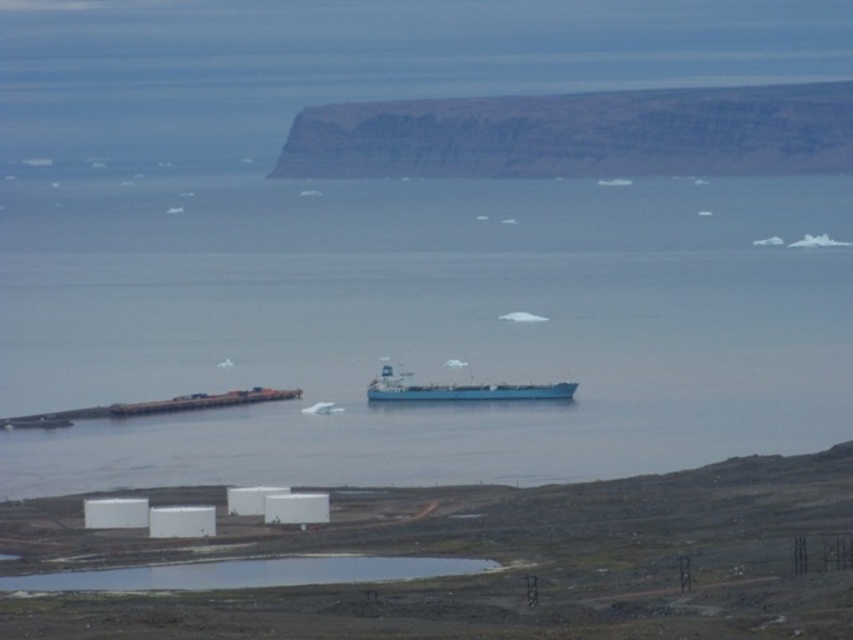
Where is `blue water at center`? This screenshot has width=853, height=640. blue water at center is located at coordinates (421, 324).

Is blue water at center thinner than rocky cliff at upper center?

Incorrect, blue water at center's width is not less than rocky cliff at upper center's.

Which is behind, point (223, 472) or point (337, 140)?

The point (223, 472) is behind.

Where is `blue water at center`? blue water at center is located at coordinates (421, 324).

Is white matte containers at lower center to the right of blue matte ship at center from the viewer's perspective?

In fact, white matte containers at lower center is to the left of blue matte ship at center.

Based on the photo, does white matte containers at lower center have a greater width compared to blue matte ship at center?

Correct, the width of white matte containers at lower center exceeds that of blue matte ship at center.

Between point (671, 573) and point (469, 388), which one is positioned behind?

Point (671, 573)

At what (x,y) coordinates should I click in order to perform the action: click on white matte containers at lower center. Please return your answer as a coordinate pair (x, y). Looking at the image, I should click on tap(492, 560).

Is rocky cliff at upper center smaller than blue matte ship at center?

Actually, rocky cliff at upper center might be larger than blue matte ship at center.

Which of these two, rocky cliff at upper center or blue matte ship at center, stands taller?

rocky cliff at upper center

Identify the location of rocky cliff at upper center. Image resolution: width=853 pixels, height=640 pixels. (578, 134).